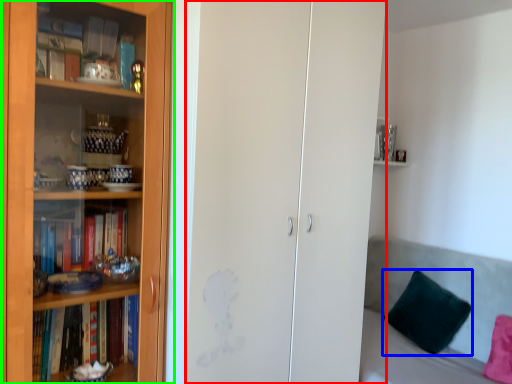
Question: Considering the real-world distances, which object is closest to glass door (highlighted by a red box)? pillow (highlighted by a blue box) or bookcase (highlighted by a green box).

Choices:
 (A) pillow
 (B) bookcase

Answer: (B)